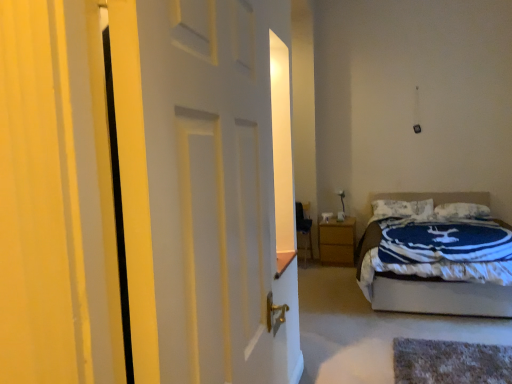
Question: In terms of height, does wooden nightstand at lower right look taller or shorter compared to white soft pillow at upper center, the second pillow in the left-to-right sequence?

Choices:
 (A) short
 (B) tall

Answer: (B)

Question: Is wooden nightstand at lower right in front of or behind white soft pillow at upper center, arranged as the 1th pillow when viewed from the right, in the image?

Choices:
 (A) front
 (B) behind

Answer: (B)

Question: Estimate the real-world distances between objects in this image. Which object is farther from the white matte door at center?

Choices:
 (A) white soft pillow at upper center, arranged as the 1th pillow when viewed from the right
 (B) white textured pillow at upper center, arranged as the second pillow when viewed from the right
 (C) blue and white quilted bed at right
 (D) wooden nightstand at lower right

Answer: (A)

Question: Estimate the real-world distances between objects in this image. Which object is farther from the blue and white quilted bed at right?

Choices:
 (A) white matte door at center
 (B) white textured pillow at upper center, which is counted as the first pillow, starting from the left
 (C) white soft pillow at upper center, the second pillow in the left-to-right sequence
 (D) wooden nightstand at lower right

Answer: (A)